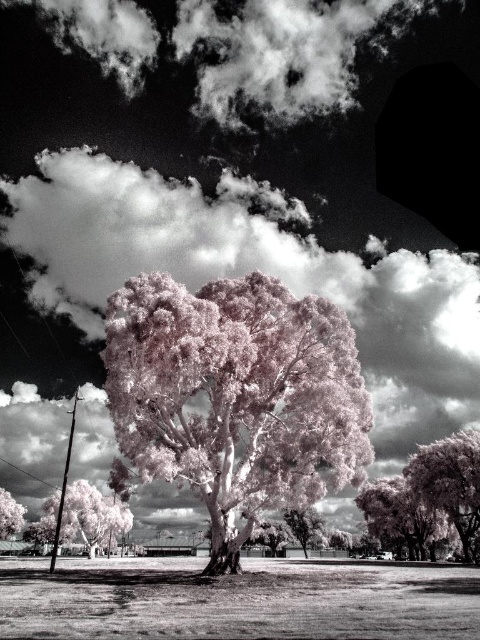
Question: Which point appears closest to the camera in this image?

Choices:
 (A) (313, 115)
 (B) (15, 508)
 (C) (71, 525)

Answer: (A)

Question: Can you confirm if smooth sand at center is thinner than pink textured tree at lower left?

Choices:
 (A) yes
 (B) no

Answer: (B)

Question: Which of the following is the closest to the observer?

Choices:
 (A) smooth sand at center
 (B) white fluffy cloud at upper center
 (C) pink textured tree at lower right

Answer: (A)

Question: Where is pink/white textured tree at center located in relation to pink textured tree at lower right in the image?

Choices:
 (A) below
 (B) above

Answer: (B)

Question: Estimate the real-world distances between objects in this image. Which object is closer to the pink/white textured tree at center?

Choices:
 (A) smooth sand at center
 (B) pink textured tree at lower right
 (C) pink translucent tree at lower right

Answer: (A)

Question: Can you confirm if pink/white textured tree at center is positioned below pink textured tree at lower right?

Choices:
 (A) yes
 (B) no

Answer: (B)